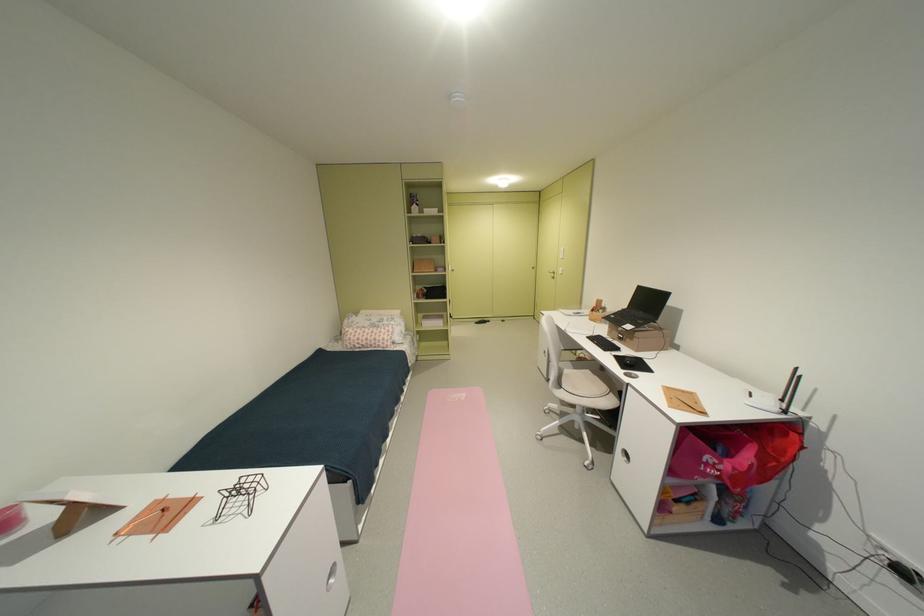
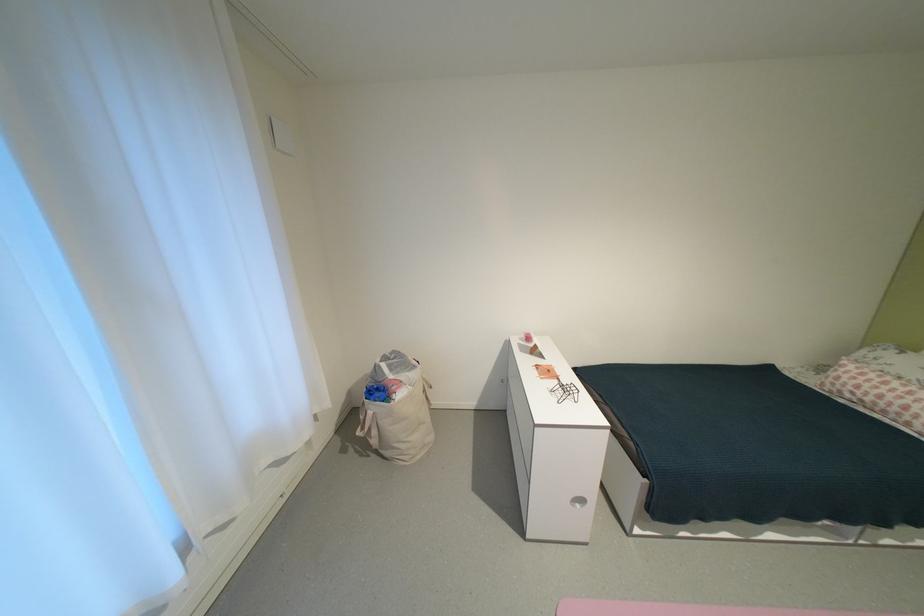
The images are taken continuously from a first-person perspective. In which direction is your viewpoint rotating?

The camera rotated toward left-down.